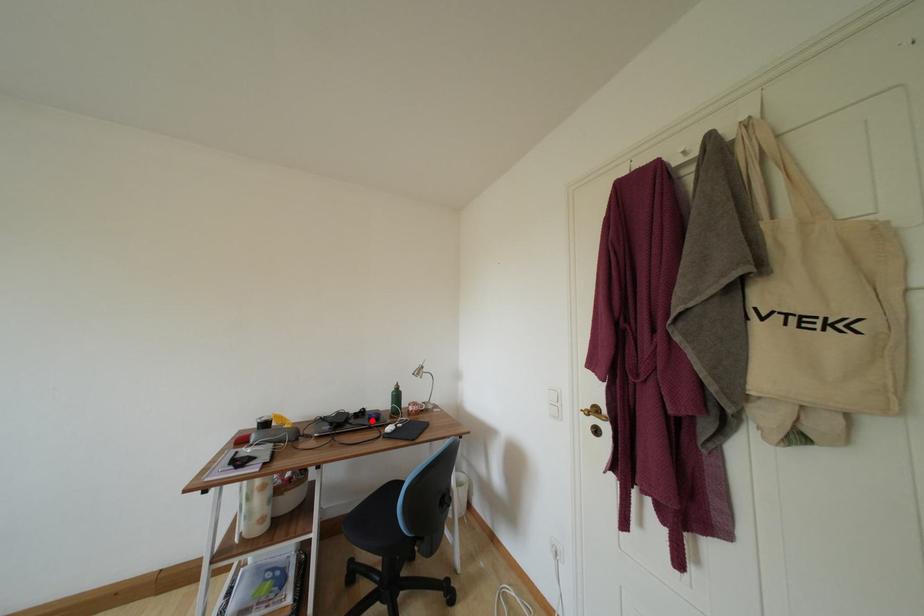
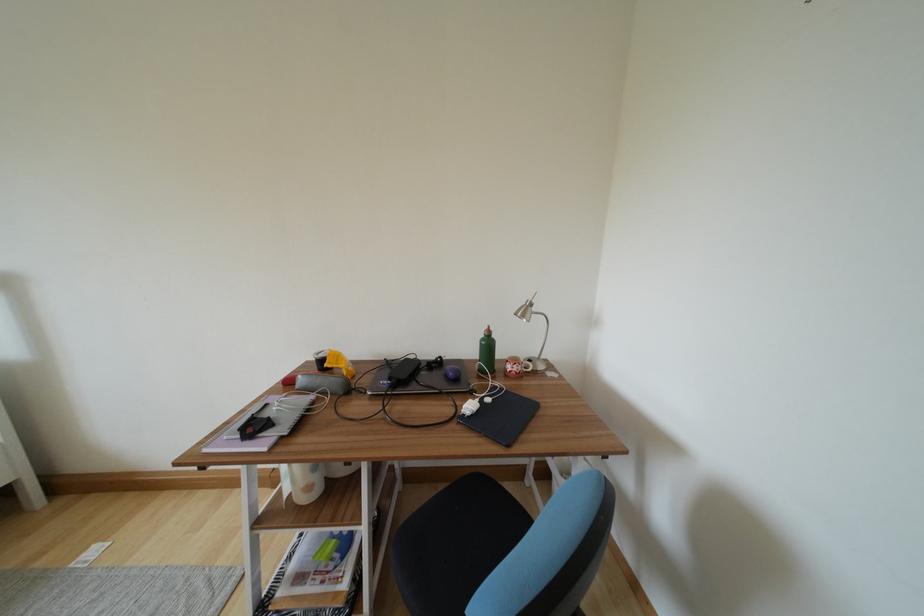
Question: A red point is marked in image1. In image2, is the corresponding 3D point closer to the camera or farther? Reply with the corresponding letter.

Choices:
 (A) The corresponding 3D point is closer.
 (B) The corresponding 3D point is farther.

Answer: (A)